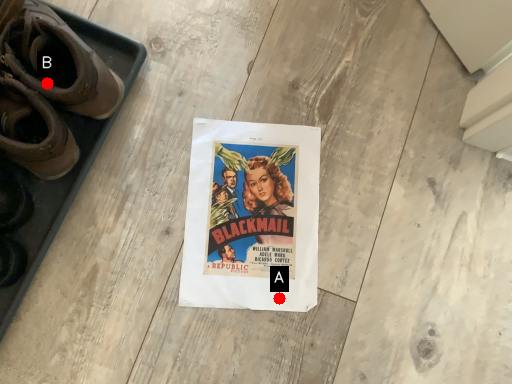
Question: Two points are circled on the image, labeled by A and B beside each circle. Which point is further to the camera?

Choices:
 (A) A is further
 (B) B is further

Answer: (A)